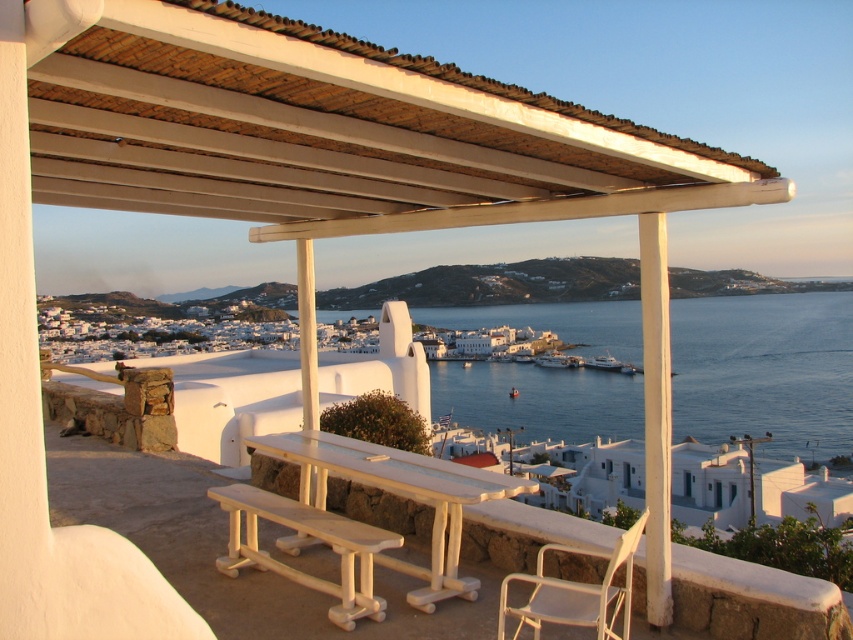
You are sitting on the shaded terrace and want to move from the white wood bench at lower center to the white plastic chair at lower right. Which direction should you move to reach the chair?

You should move towards the white plastic chair at lower right because it is behind the white wood bench at lower center, so moving backward from the bench will lead you to the chair.

You are standing on the shaded outdoor terrace and want to place a 5 meter long banner between the viewer and the white wood at upper center. Will the banner fit without needing to be folded?

The distance between the viewer and the white wood at upper center is 5.15 meters, so a 5 meter long banner can be placed there without needing to be folded as it is slightly shorter than the available space.

In the scene shown: You are a guest sitting at the white wood at upper center and want to see the white glossy boat at center. Is the boat visible from your current position?

The white wood at upper center is located above the white glossy boat at center, so the boat may be partially or fully obstructed from view depending on the height difference between the two objects.